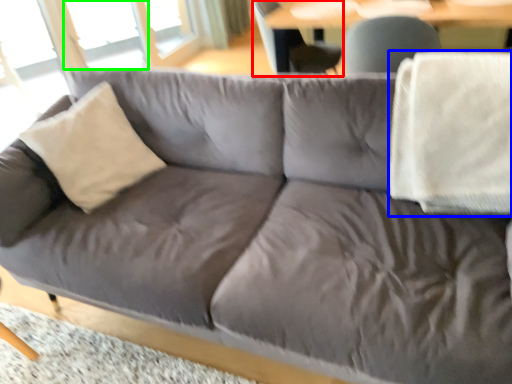
Question: Estimate the real-world distances between objects in this image. Which object is closer to swivel chair (highlighted by a red box), blanket (highlighted by a blue box) or window (highlighted by a green box)?

Choices:
 (A) blanket
 (B) window

Answer: (A)